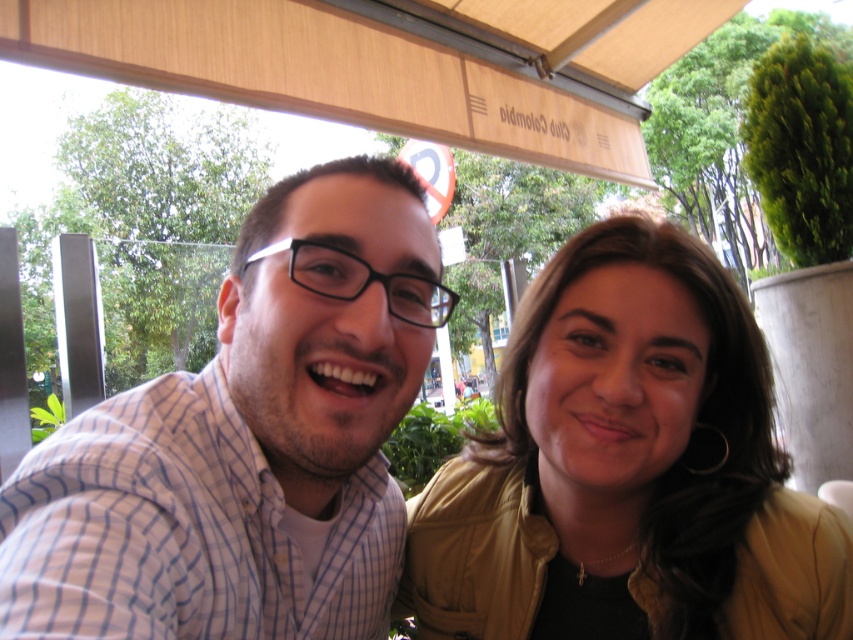
Based on the photo, measure the distance between checkered fabric shirt at center and camera.

checkered fabric shirt at center and camera are 14.15 inches apart from each other.

In the scene shown: Can you confirm if checkered fabric shirt at center is positioned to the left of matte gold jacket at center?

Indeed, checkered fabric shirt at center is positioned on the left side of matte gold jacket at center.

Image resolution: width=853 pixels, height=640 pixels. Find the location of `checkered fabric shirt at center`. checkered fabric shirt at center is located at coordinates (247, 442).